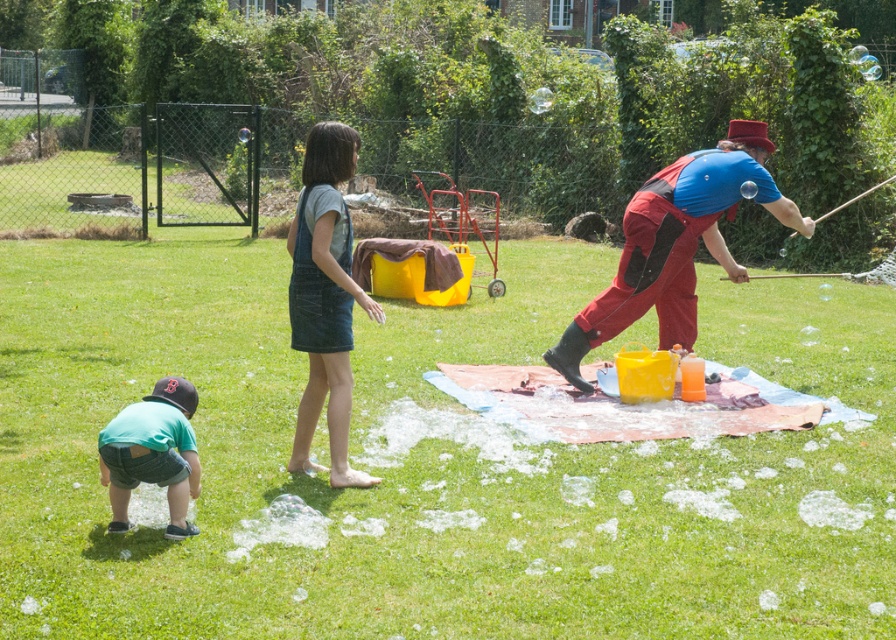
You are standing at the point labeled point (109,493) and want to walk to the point labeled point (307,260). Which direction should you move in to reach your destination?

To reach point (307,260) from point (109,493), you should move backward since point (307,260) is behind point (109,493).

You are a parent trying to choose between two outfits for your child. The matte red jumpsuit at right and the denim overalls at center are both in the store. Which outfit is shorter in length?

The matte red jumpsuit at right is not as tall as the denim overalls at center, so the matte red jumpsuit at right is shorter in length.

You are a photographer trying to capture a photo of the matte red jumpsuit at right and the green denim shorts at lower left. Based on their positions, which one should you focus on first to ensure both are in the frame?

The matte red jumpsuit at right is above the green denim shorts at lower left, so you should focus on the green denim shorts at lower left first to ensure both are in the frame.